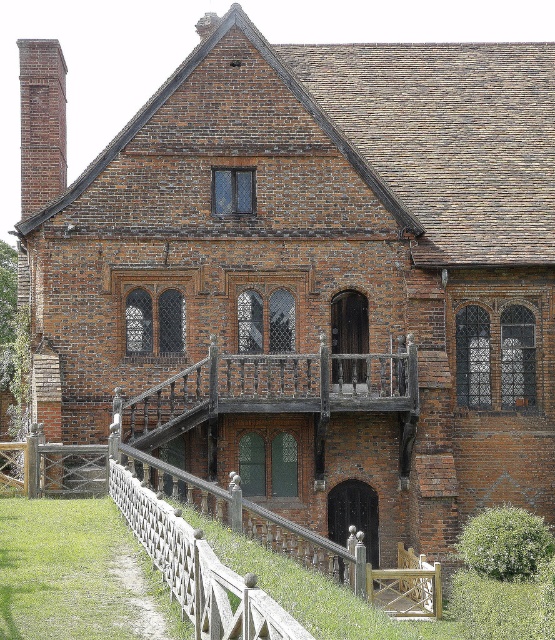
Question: Considering the relative positions of rustic wood balcony at center and brick chimney at left in the image provided, where is rustic wood balcony at center located with respect to brick chimney at left?

Choices:
 (A) below
 (B) above

Answer: (A)

Question: Is rustic wood balcony at center further to camera compared to brick chimney at left?

Choices:
 (A) yes
 (B) no

Answer: (B)

Question: Which object is positioned farthest from the brick chimney at left?

Choices:
 (A) rustic wood balcony at center
 (B) white wood fence at lower center

Answer: (B)

Question: Which object is closer to the camera taking this photo?

Choices:
 (A) white wood fence at lower center
 (B) rustic wood balcony at center

Answer: (A)

Question: From the image, what is the correct spatial relationship of rustic wood balcony at center in relation to brick chimney at left?

Choices:
 (A) right
 (B) left

Answer: (A)

Question: Which object is positioned farthest from the rustic wood balcony at center?

Choices:
 (A) white wood fence at lower center
 (B) brick chimney at left

Answer: (B)